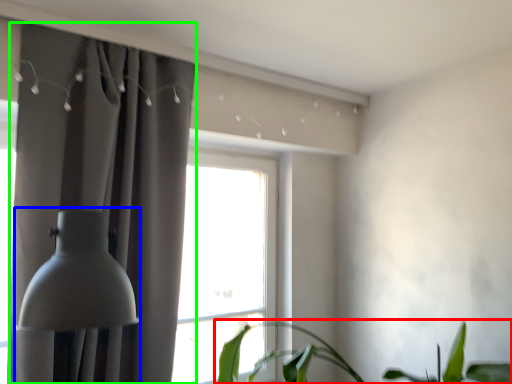
Question: Which is farther away from houseplant (highlighted by a red box)? table lamp (highlighted by a blue box) or curtain (highlighted by a green box)?

Choices:
 (A) table lamp
 (B) curtain

Answer: (A)